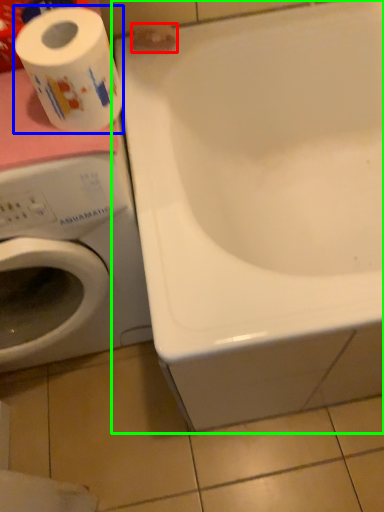
Question: Which object is the farthest from toilet paper (highlighted by a red box)? Choose among these: toilet paper (highlighted by a blue box) or bathtub (highlighted by a green box).

Choices:
 (A) toilet paper
 (B) bathtub

Answer: (A)